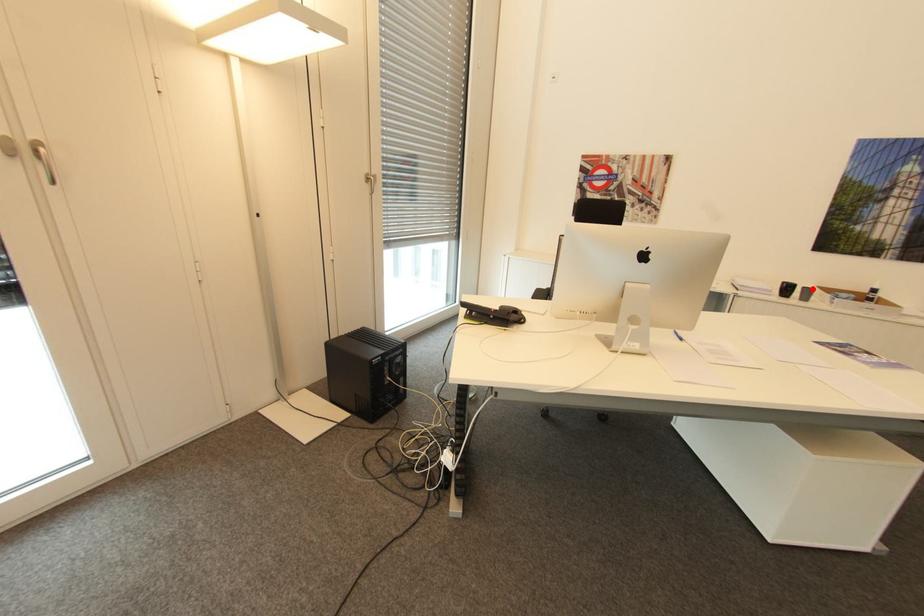
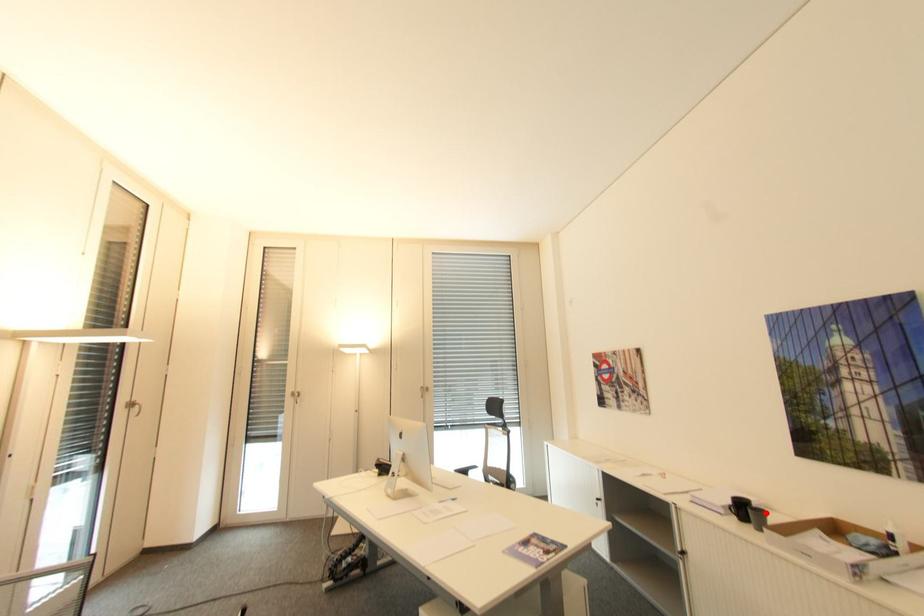
I am providing you with two images of the same scene from different viewpoints. A red point is marked on the first image and another point is marked on the second image. Does the point marked in image1 correspond to the same location as the one in image2?

Yes